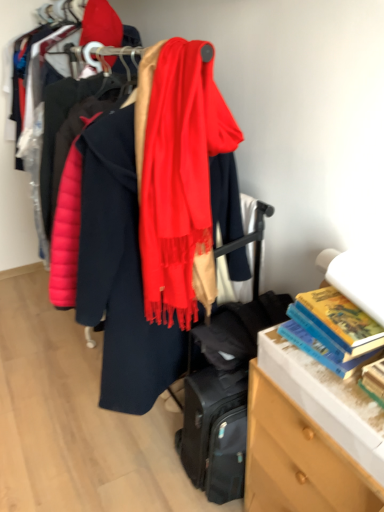
Question: Does silky red scarf at center have a lesser width compared to hardcover book at right, the second book viewed from the front?

Choices:
 (A) no
 (B) yes

Answer: (A)

Question: Is silky red scarf at center at the right side of hardcover book at right, the second book viewed from the front?

Choices:
 (A) no
 (B) yes

Answer: (A)

Question: Does silky red scarf at center have a greater height compared to hardcover book at right, the second book viewed from the front?

Choices:
 (A) yes
 (B) no

Answer: (A)

Question: Is silky red scarf at center not within hardcover book at right, the second book viewed from the front?

Choices:
 (A) yes
 (B) no

Answer: (A)

Question: From the image's perspective, is silky red scarf at center above hardcover book at right, the 1th book positioned from the back?

Choices:
 (A) no
 (B) yes

Answer: (B)

Question: Is hardcover book at right, the second book viewed from the front, in front of or behind hardcover book at right, the first book when ordered from front to back, in the image?

Choices:
 (A) front
 (B) behind

Answer: (B)

Question: Considering the relative positions of hardcover book at right, the 1th book positioned from the back, and hardcover book at right, acting as the second book starting from the back, in the image provided, is hardcover book at right, the 1th book positioned from the back, to the left or to the right of hardcover book at right, acting as the second book starting from the back,?

Choices:
 (A) left
 (B) right

Answer: (A)

Question: Looking at the image, does hardcover book at right, the 1th book positioned from the back, seem bigger or smaller compared to hardcover book at right, the first book when ordered from front to back?

Choices:
 (A) big
 (B) small

Answer: (A)

Question: Would you say hardcover book at right, the 1th book positioned from the back, is inside or outside hardcover book at right, acting as the second book starting from the back?

Choices:
 (A) outside
 (B) inside

Answer: (A)

Question: From their relative heights in the image, would you say hardcover book at right, acting as the second book starting from the back, is taller or shorter than silky red scarf at center?

Choices:
 (A) short
 (B) tall

Answer: (A)

Question: Does point (375, 378) appear closer or farther from the camera than point (140, 66)?

Choices:
 (A) farther
 (B) closer

Answer: (B)

Question: Considering the relative positions of hardcover book at right, acting as the second book starting from the back, and silky red scarf at center in the image provided, is hardcover book at right, acting as the second book starting from the back, to the left or to the right of silky red scarf at center?

Choices:
 (A) left
 (B) right

Answer: (B)

Question: Is hardcover book at right, the first book when ordered from front to back, wider or thinner than silky red scarf at center?

Choices:
 (A) thin
 (B) wide

Answer: (A)

Question: In terms of height, does silky red scarf at center look taller or shorter compared to hardcover book at right, the second book viewed from the front?

Choices:
 (A) tall
 (B) short

Answer: (A)

Question: Considering the positions of point (145, 293) and point (345, 358), is point (145, 293) closer or farther from the camera than point (345, 358)?

Choices:
 (A) closer
 (B) farther

Answer: (B)